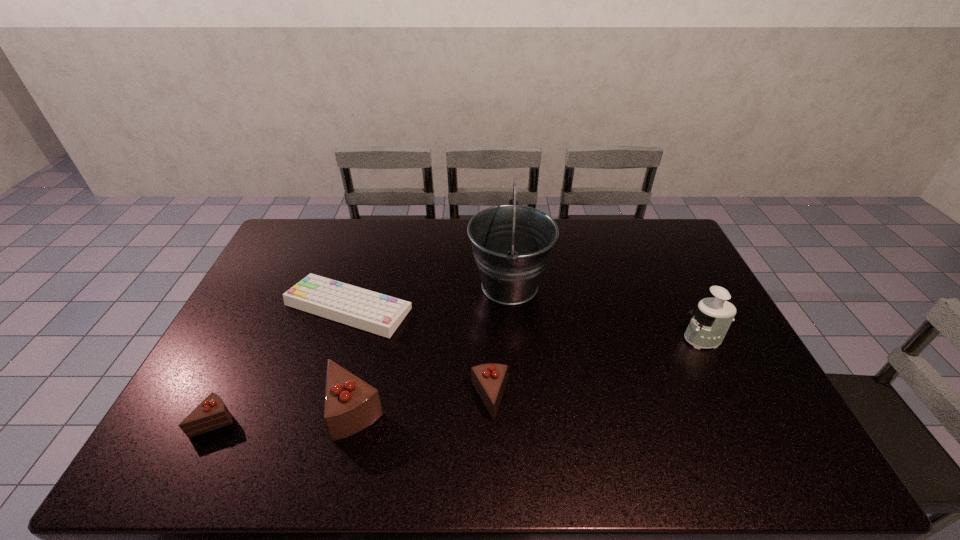
Locate an element on the screen. The width and height of the screenshot is (960, 540). the shortest chocolate cake is located at coordinates coord(211,414).

This screenshot has width=960, height=540. I want to click on the leftmost chocolate cake, so click(211, 414).

In order to click on the tallest chocolate cake in this screenshot , I will do [x=351, y=404].

I want to click on the fourth shortest object, so click(351, 404).

Identify the location of the fourth tallest object. (489, 380).

This screenshot has width=960, height=540. In order to click on the second tallest chocolate cake in this screenshot , I will do `click(489, 380)`.

The width and height of the screenshot is (960, 540). In order to click on bucket in this screenshot , I will do `click(512, 244)`.

The width and height of the screenshot is (960, 540). Identify the location of the rightmost object. (710, 322).

Locate an element on the screen. The height and width of the screenshot is (540, 960). juicer is located at coordinates (710, 322).

Locate an element on the screen. This screenshot has height=540, width=960. computer keyboard is located at coordinates pos(380,314).